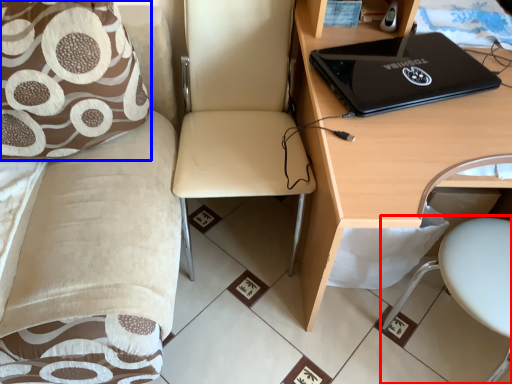
Question: Which object appears farthest to the camera in this image, swivel chair (highlighted by a red box) or pillow (highlighted by a blue box)?

Choices:
 (A) swivel chair
 (B) pillow

Answer: (A)